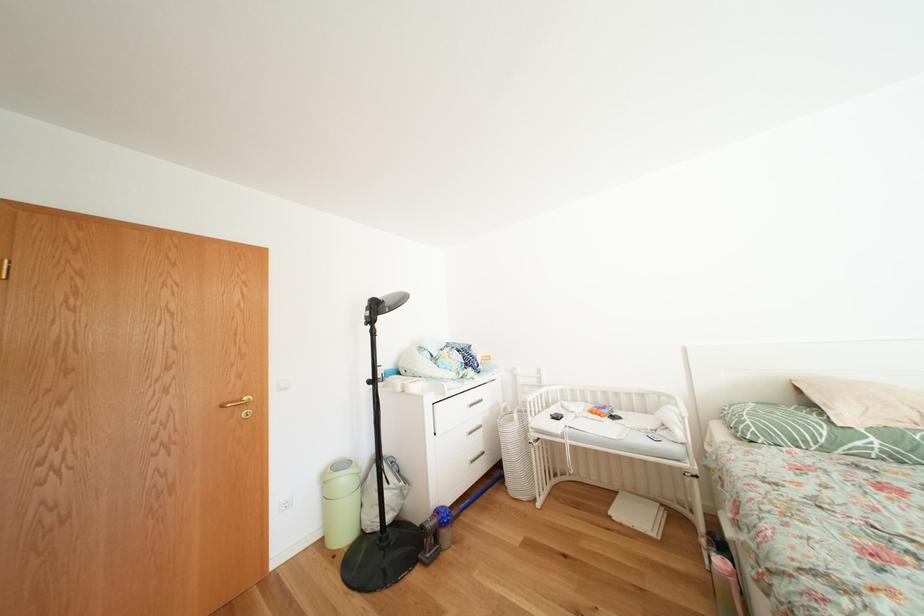
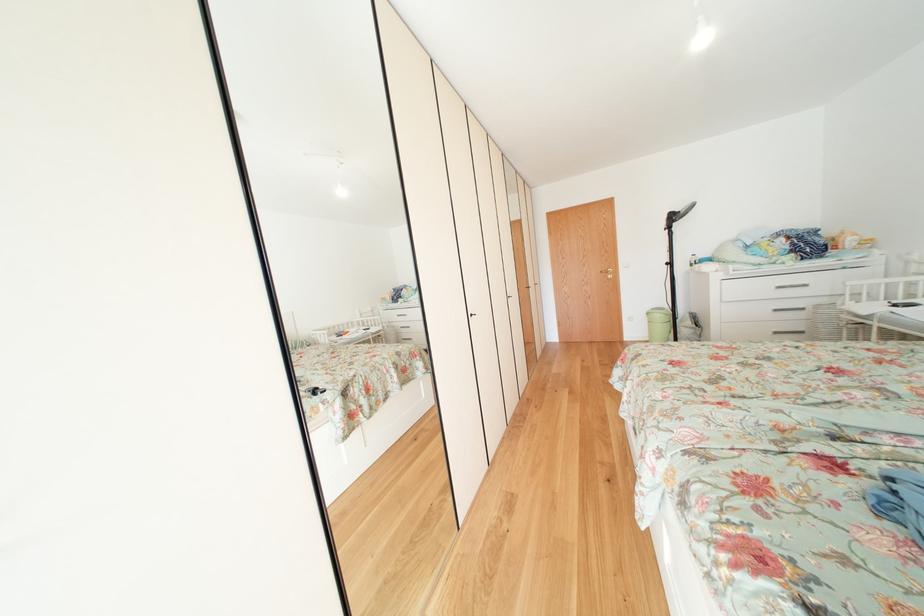
In the second image, find the point that corresponds to [480,411] in the first image.

(787, 292)